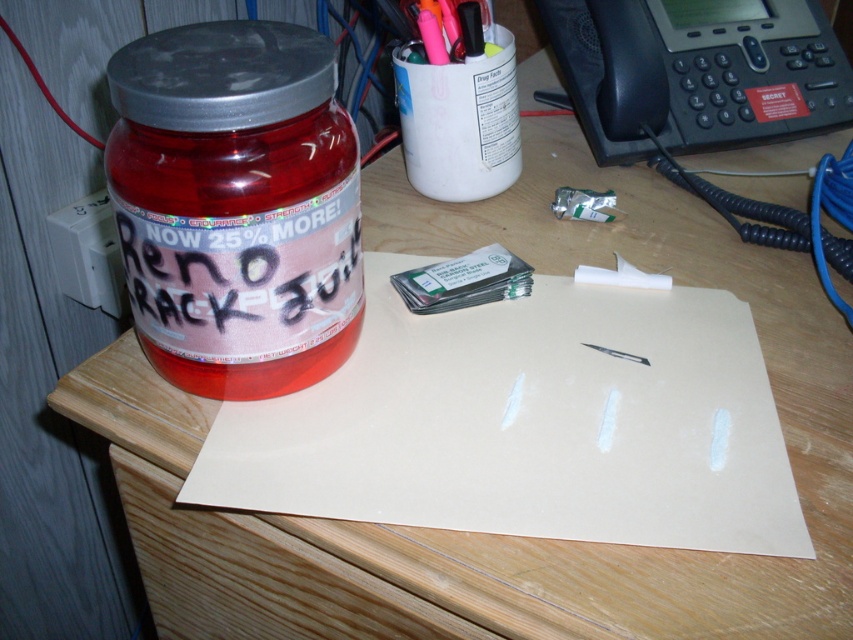
Question: Does translucent plastic jar at left have a greater width compared to matte pink plastic jar at left?

Choices:
 (A) no
 (B) yes

Answer: (B)

Question: Which object appears closest to the camera in this image?

Choices:
 (A) white matte paper at center
 (B) translucent plastic jar at left
 (C) matte pink plastic jar at left

Answer: (B)

Question: Estimate the real-world distances between objects in this image. Which object is farther from the matte pink plastic jar at left?

Choices:
 (A) white matte paper at center
 (B) translucent plastic jar at left

Answer: (A)

Question: Is white matte paper at center wider than translucent plastic jar at left?

Choices:
 (A) no
 (B) yes

Answer: (B)

Question: Which point is closer to the camera?

Choices:
 (A) (259, 456)
 (B) (140, 104)

Answer: (B)

Question: Does translucent plastic jar at left appear over matte pink plastic jar at left?

Choices:
 (A) no
 (B) yes

Answer: (B)